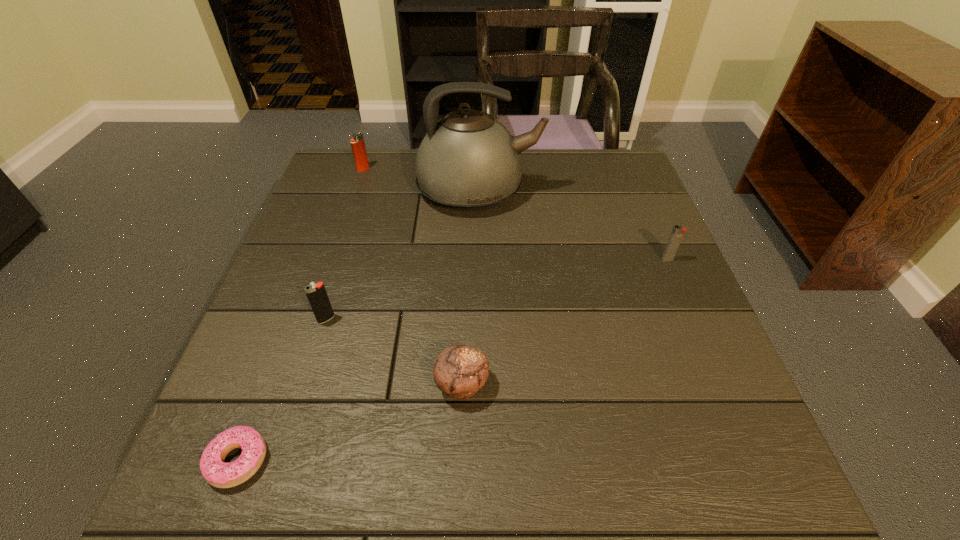
Image resolution: width=960 pixels, height=540 pixels. In order to click on object that is at the near left corner in this screenshot , I will do `click(216, 472)`.

This screenshot has width=960, height=540. I want to click on vacant space at the far edge, so click(x=547, y=171).

Identify the location of free space at the near edge of the desktop. (327, 463).

What are the coordinates of `vacant space at the left edge of the desktop` in the screenshot? It's located at (336, 308).

Identify the location of vacant space at the right edge of the desktop. This screenshot has height=540, width=960. (603, 225).

Find the location of `free space at the far left corner of the desktop`. free space at the far left corner of the desktop is located at coordinates (342, 154).

In the image, there is a desktop. Where is `vacant space at the far right corner`? This screenshot has width=960, height=540. vacant space at the far right corner is located at coordinates (599, 148).

Find the location of a particular element. vacant space at the near right corner of the desktop is located at coordinates (735, 500).

The height and width of the screenshot is (540, 960). In order to click on free space between the farthest igniter and the second nearest igniter in this screenshot , I will do `click(516, 214)`.

Where is `free space between the muffin and the nearest igniter`? free space between the muffin and the nearest igniter is located at coordinates (395, 352).